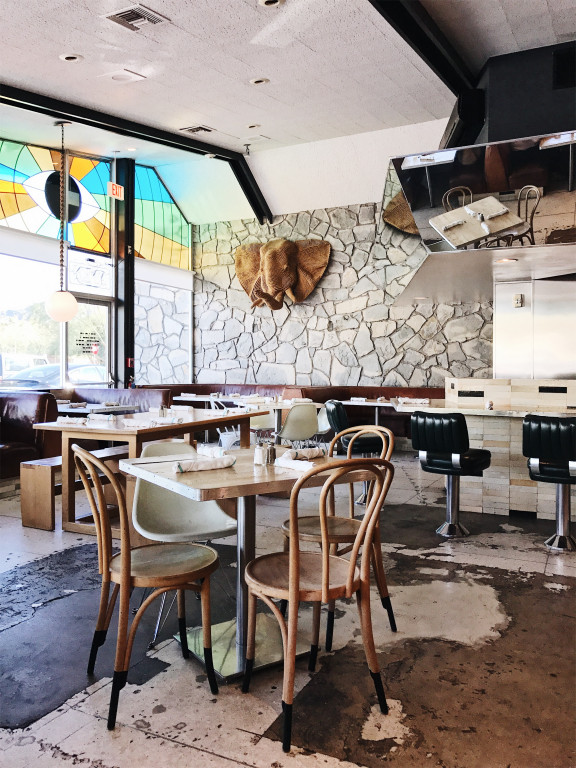
You are a GUI agent. You are given a task and a screenshot of the screen. Output one action in this format:
    pyautogui.click(x=<x>, y=<y>)
    Task: Click on the rug
    Image resolution: width=576 pixels, height=768 pixels.
    Given the screenshot: What is the action you would take?
    pyautogui.click(x=51, y=644)